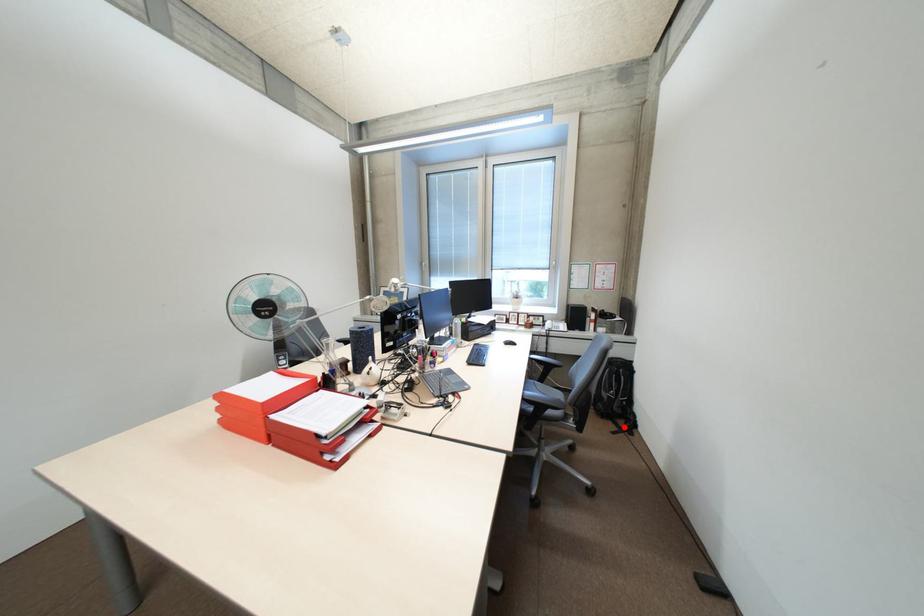
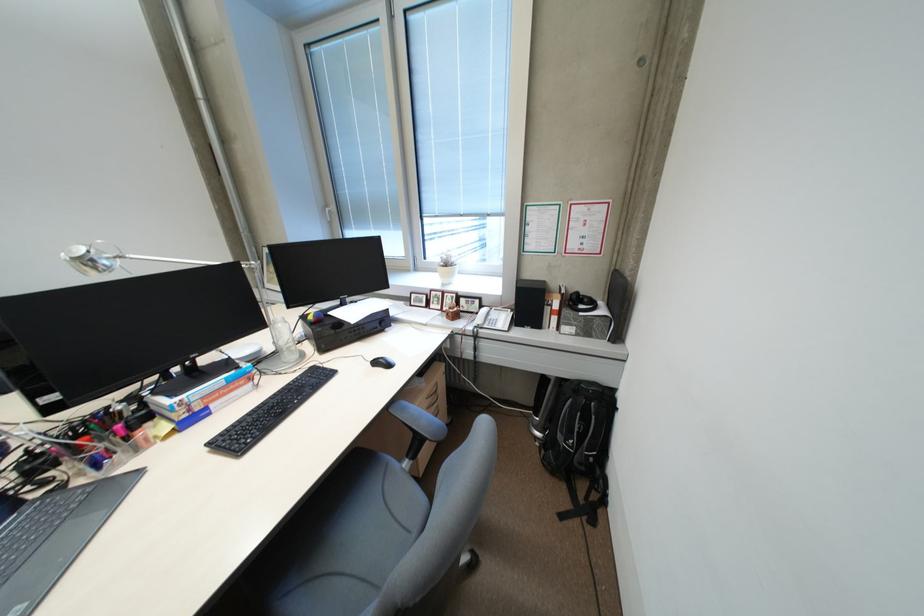
Find the pixel in the second image that matches the highlighted location in the first image.

(576, 501)